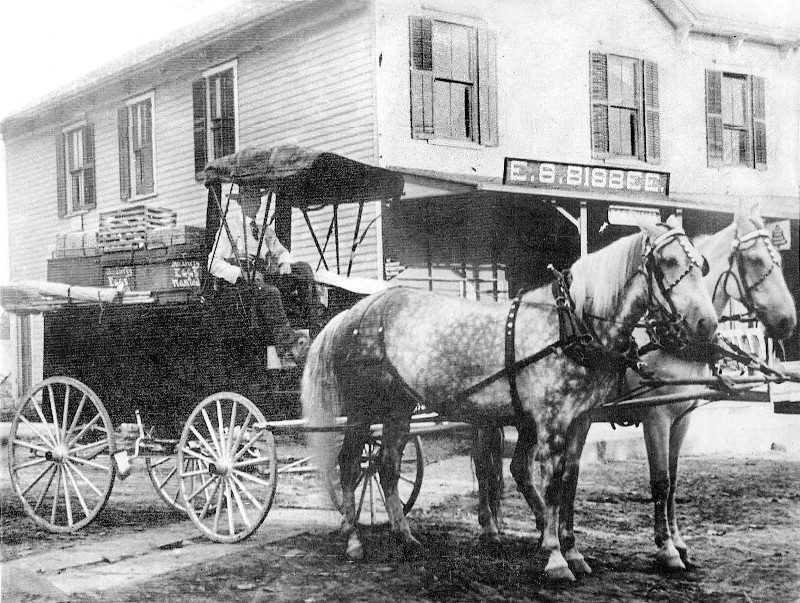
Find the location of `window`. window is located at coordinates (458, 116), (617, 116), (729, 131), (222, 118), (140, 127), (77, 155).